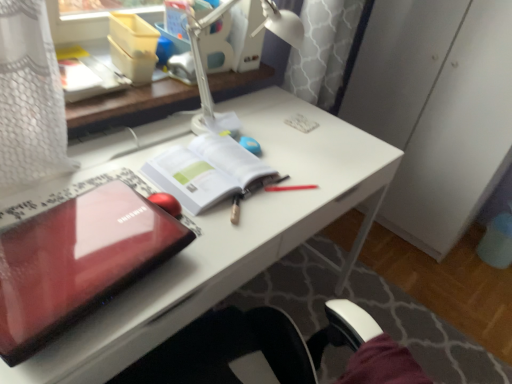
Where is `free space in front of white paper at center`? The height and width of the screenshot is (384, 512). free space in front of white paper at center is located at coordinates (217, 234).